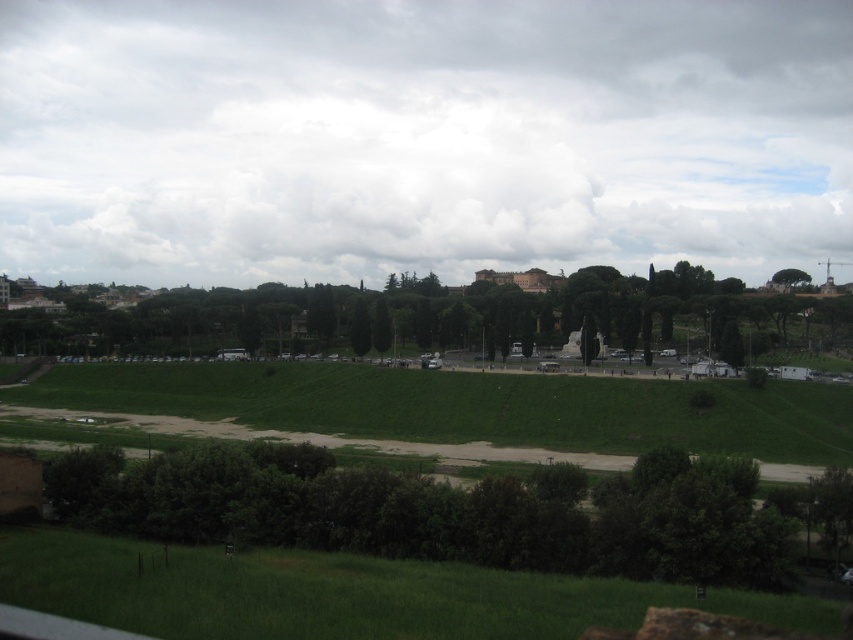
Question: Which object is farther from the camera taking this photo?

Choices:
 (A) green leafy tree at lower center
 (B) green grass at lower center
 (C) green grassy hillside at center

Answer: (C)

Question: Is green grassy hillside at center above green leafy tree at upper right?

Choices:
 (A) no
 (B) yes

Answer: (A)

Question: Estimate the real-world distances between objects in this image. Which object is farther from the green leafy tree at center?

Choices:
 (A) green leafy tree at lower center
 (B) green leafy tree at upper right
 (C) green grass at lower center
 (D) green grassy hillside at center

Answer: (C)

Question: Which point appears closest to the camera in this image?

Choices:
 (A) (173, 520)
 (B) (779, 280)
 (C) (294, 365)
 (D) (230, 339)

Answer: (A)

Question: Does green leafy tree at lower center lie behind green grass at lower center?

Choices:
 (A) no
 (B) yes

Answer: (B)

Question: Is green leafy tree at center behind green leafy tree at upper right?

Choices:
 (A) yes
 (B) no

Answer: (B)